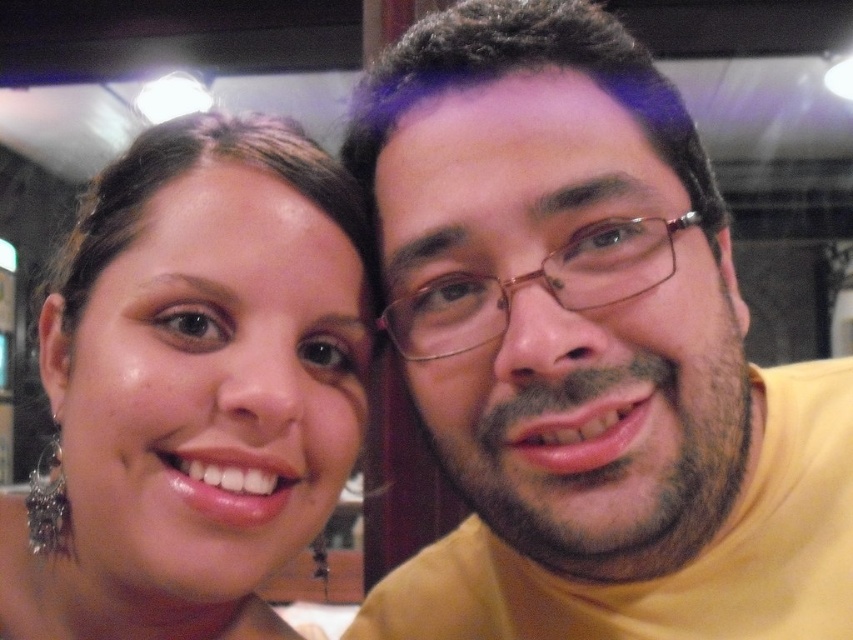
You are a photographer trying to place a sticker on the yellow matte shirt at right. The sticker is 0.05 units wide. You want to place it at the point with coordinates point at point (585, 349). Will the sticker fit entirely on the yellow matte shirt at right?

The point at (585, 349) is on the yellow matte shirt at right, so placing a sticker 0.05 units wide there will fit entirely on the yellow matte shirt at right.

You are a photographer adjusting the focus on your camera. You notice the yellow matte shirt at right and the matte gold earring at left in your frame. Which object should you focus on first to ensure both are in focus?

You should focus on the yellow matte shirt at right first because it is closer to the viewer than the matte gold earring at left, so adjusting focus starting from the closer object ensures both can be in focus.